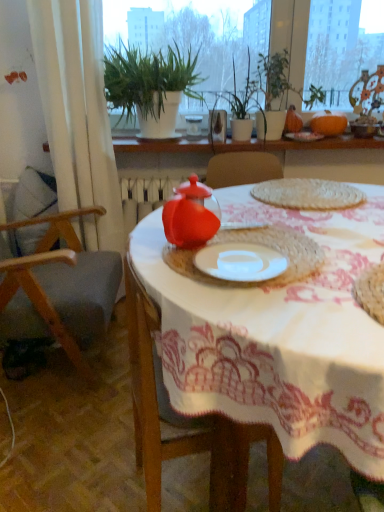
Image resolution: width=384 pixels, height=512 pixels. Find the location of `vacant area that lies between woven mat at center and matte plastic teapot at center, which is counted as the 1th tableware, starting from the left`. vacant area that lies between woven mat at center and matte plastic teapot at center, which is counted as the 1th tableware, starting from the left is located at coordinates (273, 216).